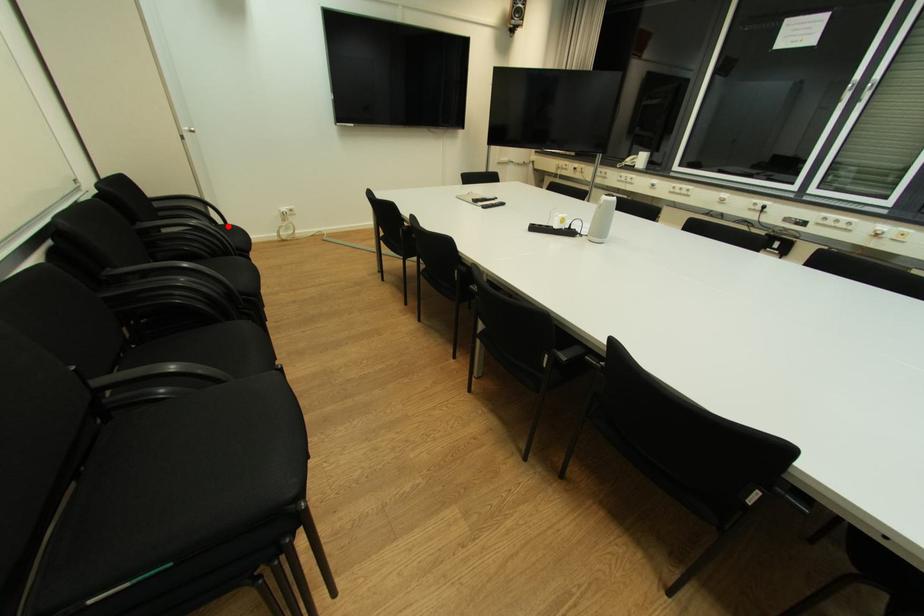
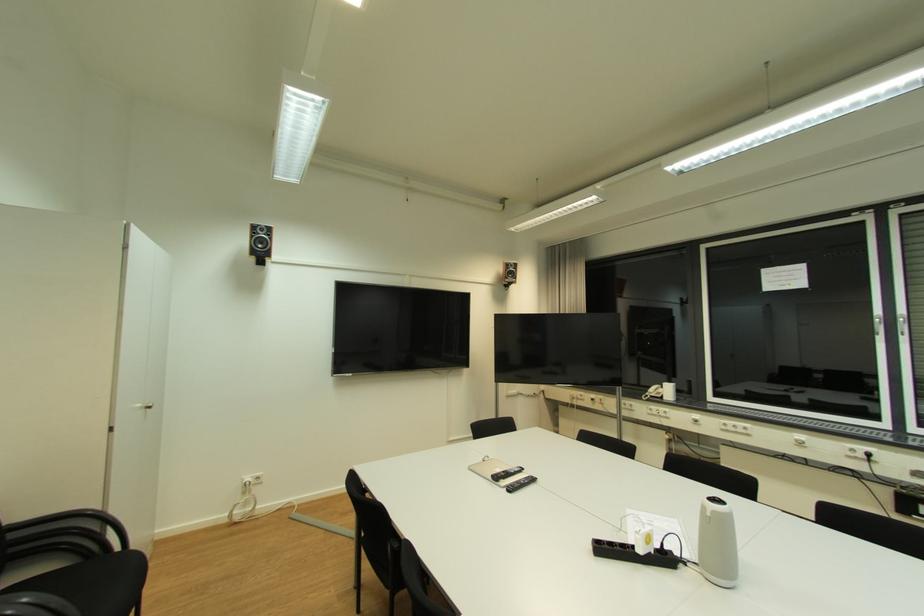
Find the pixel in the second image that matches the highlighted location in the first image.

(122, 554)